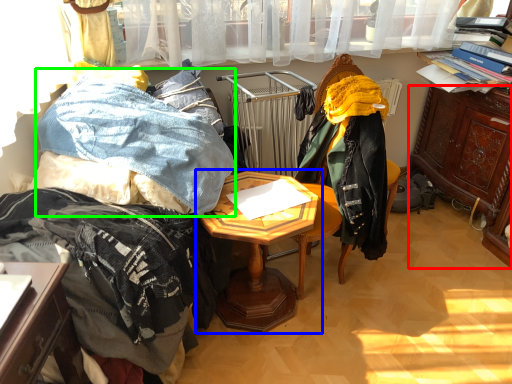
Question: Which object is positioned farthest from cabinetry (highlighted by a red box)? Select from table (highlighted by a blue box) and clothing (highlighted by a green box).

Choices:
 (A) table
 (B) clothing

Answer: (B)